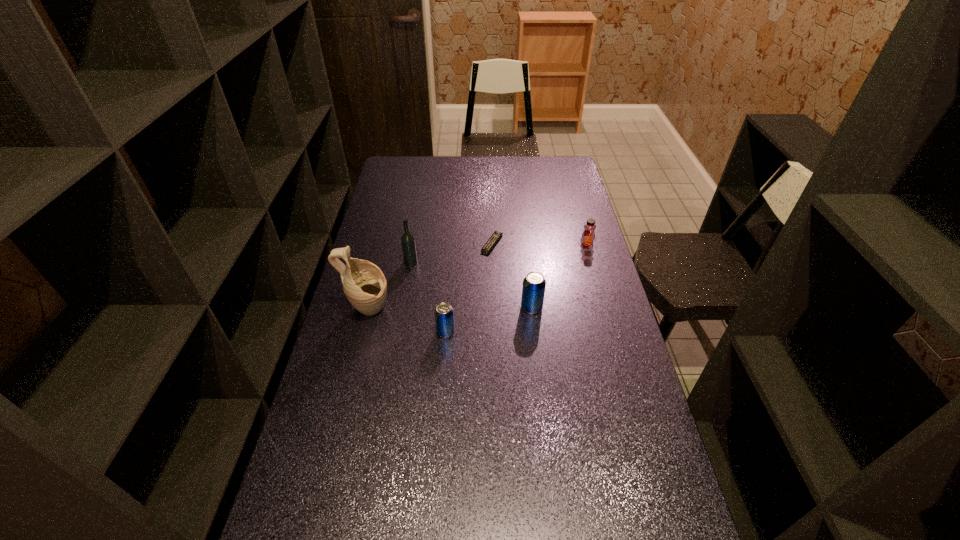
The height and width of the screenshot is (540, 960). Find the location of `the shorter beer can`. the shorter beer can is located at coordinates (444, 316).

Identify the location of the nearer beer can. (444, 316).

Where is `the fourth shortest object`? The image size is (960, 540). the fourth shortest object is located at coordinates (533, 290).

Find the location of `the fifth object from left to right`. the fifth object from left to right is located at coordinates (533, 290).

Find the location of a particular element. remote control is located at coordinates tap(485, 250).

You are a GUI agent. You are given a task and a screenshot of the screen. Output one action in this format:
    pyautogui.click(x=<x>, y=<y>)
    Task: Click on the shortest object
    The height and width of the screenshot is (540, 960).
    Given the screenshot: What is the action you would take?
    pyautogui.click(x=485, y=250)

Where is `the fifth shortest object`? the fifth shortest object is located at coordinates (408, 244).

This screenshot has height=540, width=960. What are the coordinates of `vodka` in the screenshot? It's located at (408, 244).

The width and height of the screenshot is (960, 540). I want to click on the tallest object, so click(x=364, y=284).

You are a GUI agent. You are given a task and a screenshot of the screen. Output one action in this format:
    pyautogui.click(x=<x>, y=<y>)
    Task: Click on the leftmost object
    The image size is (960, 540).
    Given the screenshot: What is the action you would take?
    pyautogui.click(x=364, y=284)